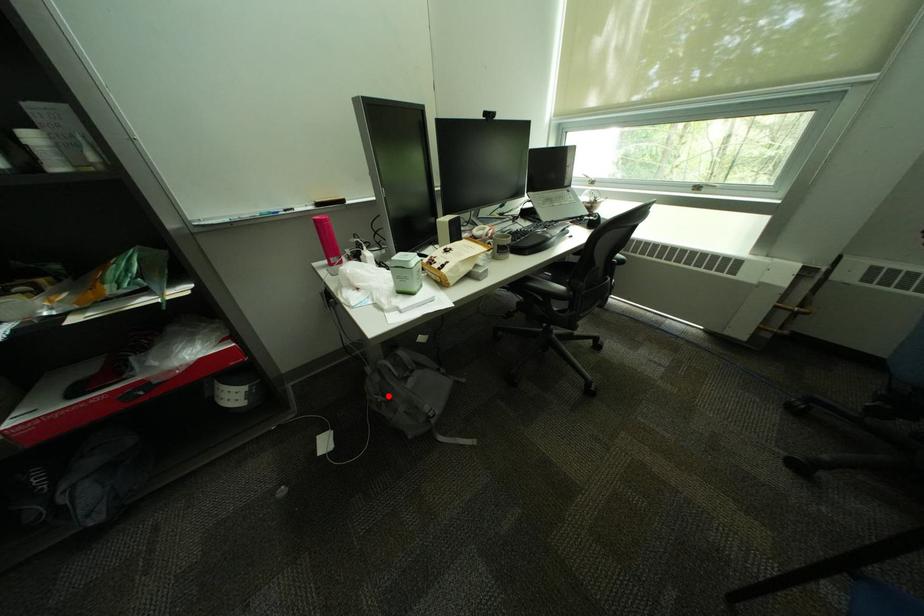
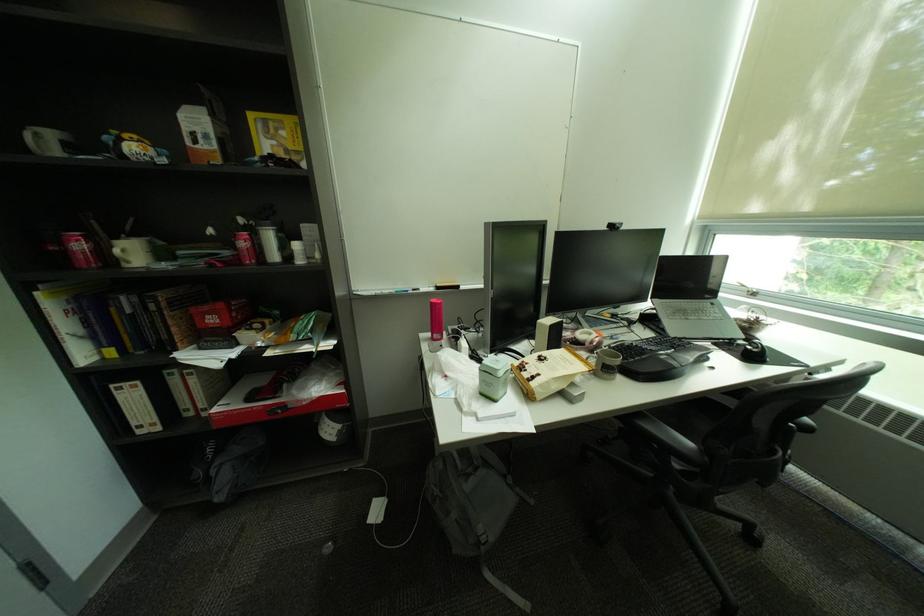
Question: I am providing you with two images of the same scene from different viewpoints. A red point is shown in image1. For the corresponding object point in image2, is it positioned nearer or farther from the camera?

Choices:
 (A) Nearer
 (B) Farther

Answer: (B)